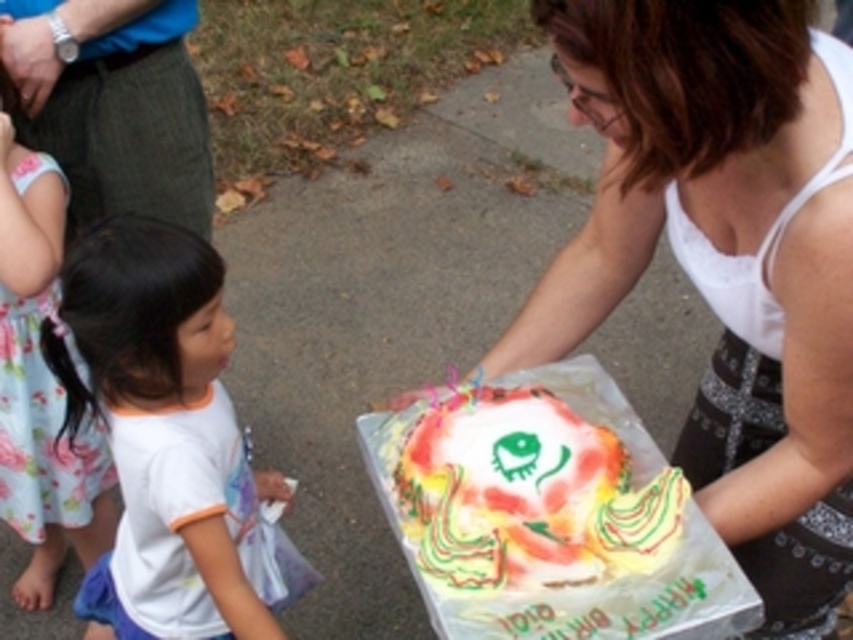
Based on the scene description, which clothing item is larger in size between the white matte tank top at center and the white cotton shirt at lower left?

The white matte tank top at center is larger in size compared to the white cotton shirt at lower left according to the description.

You are standing at the origin point in the image. Which of the two points, point (834, 120) or point (57, 490), is closer to you?

Point (834, 120) is in front of point (57, 490), so it is closer to you.